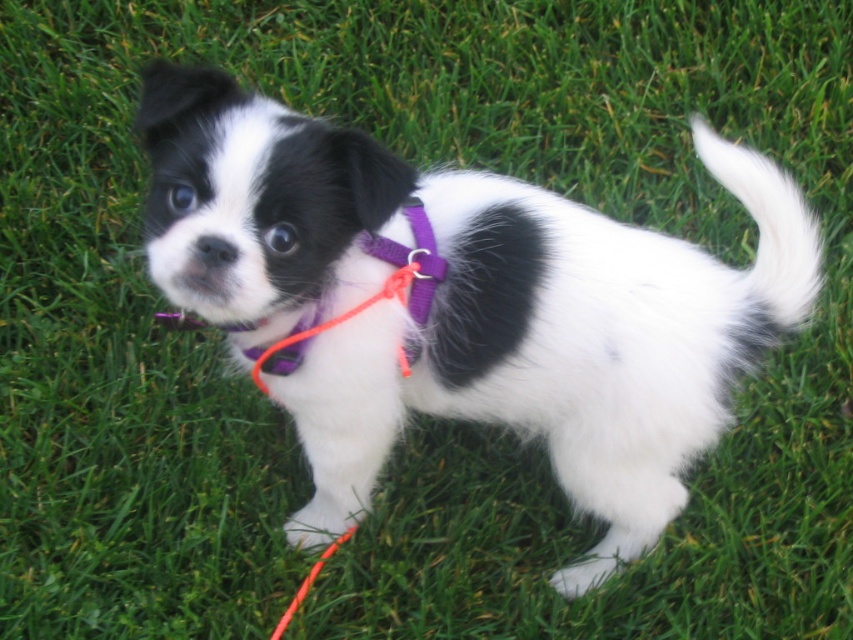
You are a dog trainer assessing the size of the dog and its harness. Based on the scene, which object is wider, the black and white fur at center or the purple fabric neckband at center?

The black and white fur at center is wider than the purple fabric neckband at center according to the description.

You are a dog trainer observing the scene. You see the black and white fur at center and the purple fabric neckband at center. Which object is located below the other?

The black and white fur at center is positioned under the purple fabric neckband at center, so the black and white fur at center is below the purple fabric neckband at center.